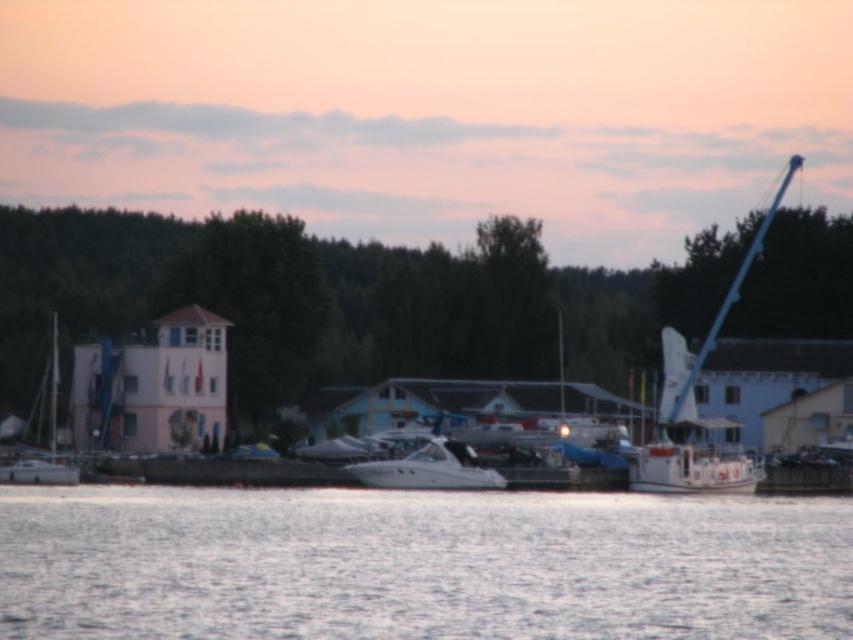
You are a photographer wanting to capture both the white glossy boat at center and the white glossy sailboat at left in your shot. Which of the two boats is shorter in height?

The white glossy boat at center has a lesser height compared to the white glossy sailboat at left, so the white glossy boat at center is shorter in height.

You are an observer standing on the dock looking out at the waterfront scene. You notice the clear water at center and the white glossy boat at center. Which object takes up more space in the image?

The clear water at center has a larger size compared to the white glossy boat at center, so it takes up more space in the image.

You are a tour guide leading a group of visitors to the white glossy boat at center. You see the white glossy sailboat at left nearby. How far apart are these two boats?

The white glossy boat at center and the white glossy sailboat at left are 13.08 meters apart.